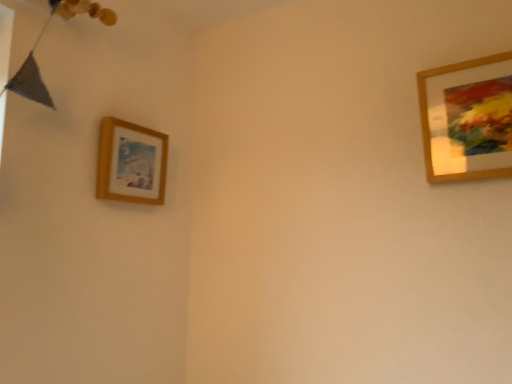
Question: Considering the positions of wooden picture frame at upper right, placed as the 1th picture frame when sorted from right to left, and wooden picture frame at upper left, arranged as the 2th picture frame when viewed from the right, in the image, is wooden picture frame at upper right, placed as the 1th picture frame when sorted from right to left, bigger or smaller than wooden picture frame at upper left, arranged as the 2th picture frame when viewed from the right,?

Choices:
 (A) small
 (B) big

Answer: (B)

Question: Is wooden picture frame at upper right, acting as the first picture frame starting from the front, in front of or behind wooden picture frame at upper left, placed as the 1th picture frame when sorted from back to front, in the image?

Choices:
 (A) behind
 (B) front

Answer: (B)

Question: From the image's perspective, is wooden picture frame at upper right, acting as the first picture frame starting from the front, above or below wooden picture frame at upper left, placed as the 1th picture frame when sorted from back to front?

Choices:
 (A) below
 (B) above

Answer: (B)

Question: Visually, is wooden picture frame at upper left, the second picture frame viewed from the front, positioned to the left or to the right of wooden picture frame at upper right, placed as the 1th picture frame when sorted from right to left?

Choices:
 (A) right
 (B) left

Answer: (B)

Question: From the image's perspective, is wooden picture frame at upper left, which is counted as the first picture frame, starting from the left, located above or below wooden picture frame at upper right, acting as the first picture frame starting from the front?

Choices:
 (A) below
 (B) above

Answer: (A)

Question: Is point (145, 150) positioned closer to the camera than point (479, 129)?

Choices:
 (A) closer
 (B) farther

Answer: (B)

Question: From a real-world perspective, is wooden picture frame at upper left, the second picture frame viewed from the front, physically located above or below wooden picture frame at upper right, acting as the first picture frame starting from the front?

Choices:
 (A) below
 (B) above

Answer: (A)